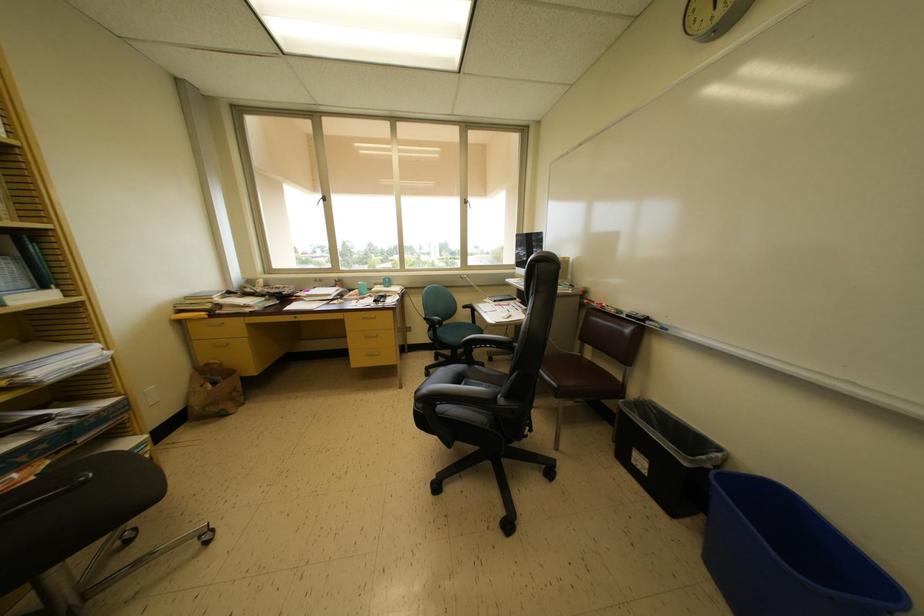
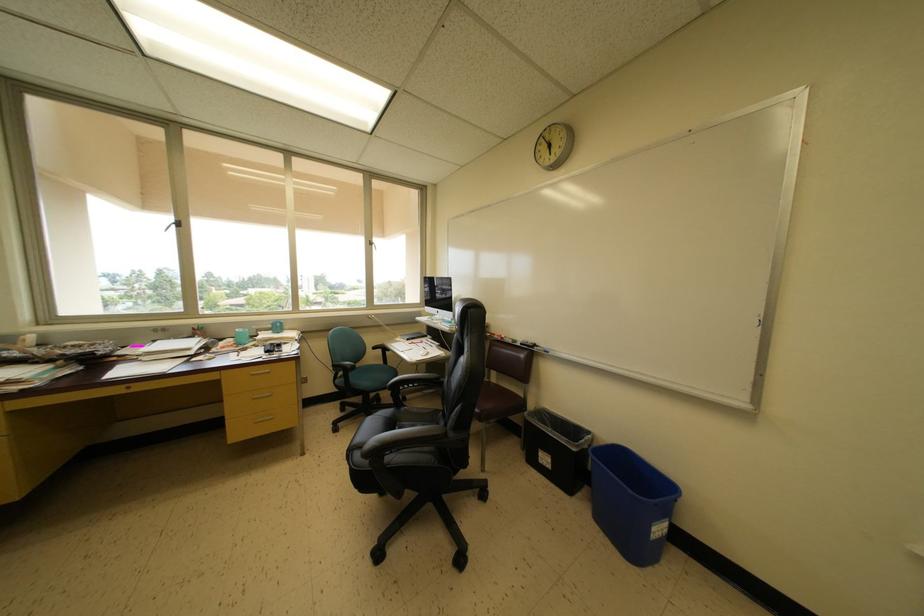
In the second image, find the point that corresponds to point (563, 391) in the first image.

(485, 416)